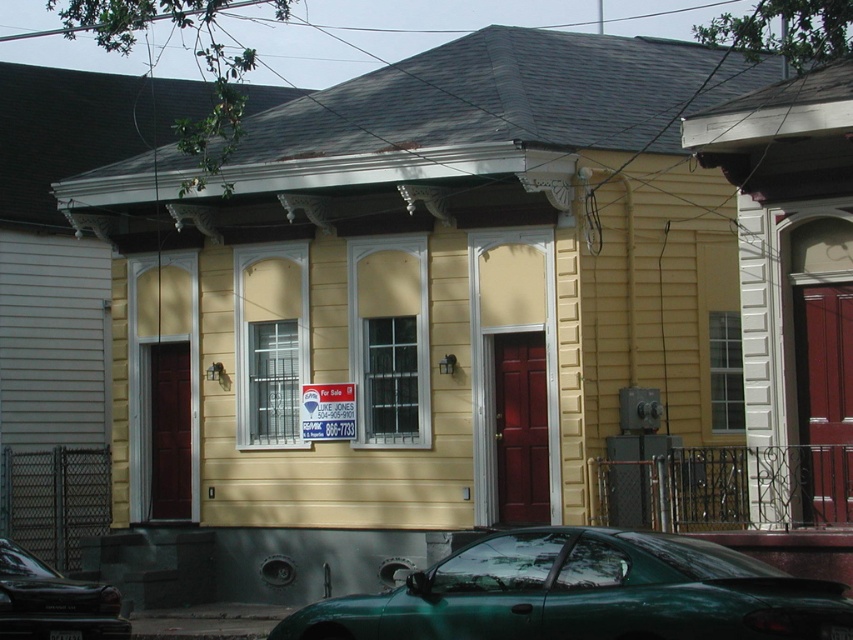
You are standing in front of the two story residential building and want to locate the point at coordinates point (585, 593). Based on the scene description, where would this point be located?

The point (585, 593) is on the green matte car at lower center.

You are standing in front of the house and see two cars, a green matte car at lower center and a metallic green car at lower center. Which car is nearer to you?

The green matte car at lower center is closer to the viewer than the metallic green car at lower center.